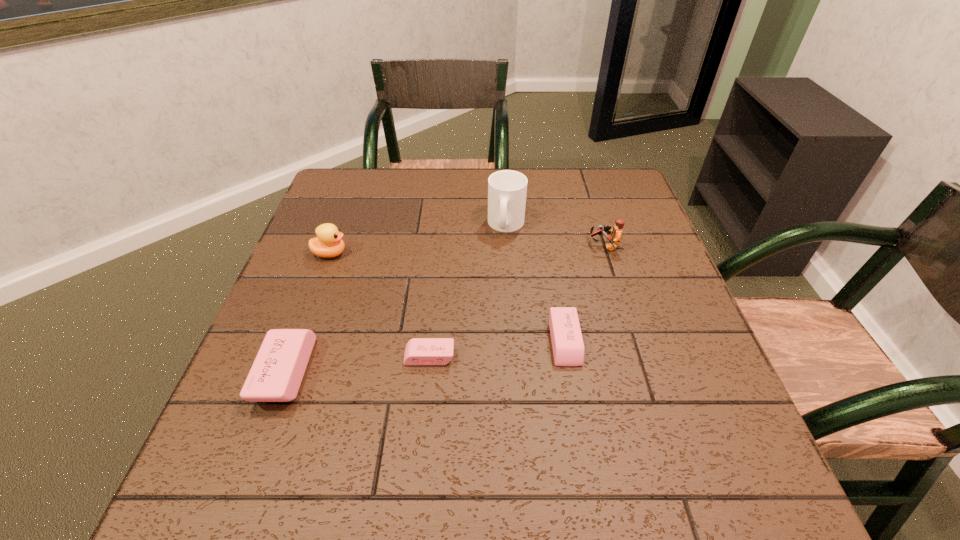
Find the location of a particular element. eraser situated at the left edge is located at coordinates (277, 372).

This screenshot has height=540, width=960. Identify the location of duckling at the left edge. (328, 243).

What are the coordinates of `object at the right edge` in the screenshot? It's located at (616, 234).

This screenshot has height=540, width=960. In order to click on object that is at the near left corner in this screenshot , I will do `click(277, 372)`.

The height and width of the screenshot is (540, 960). In the image, there is a desktop. Identify the location of free space at the far edge. (452, 181).

In the image, there is a desktop. What are the coordinates of `vacant space at the near edge` in the screenshot? It's located at (586, 403).

The image size is (960, 540). What are the coordinates of `vacant space at the left edge of the desktop` in the screenshot? It's located at (318, 215).

Locate an element on the screen. Image resolution: width=960 pixels, height=540 pixels. vacant area at the right edge of the desktop is located at coordinates (643, 287).

The width and height of the screenshot is (960, 540). Find the location of `free space at the far left corner of the desktop`. free space at the far left corner of the desktop is located at coordinates (336, 188).

In the image, there is a desktop. Where is `vacant space at the far right corner`? The width and height of the screenshot is (960, 540). vacant space at the far right corner is located at coordinates (623, 168).